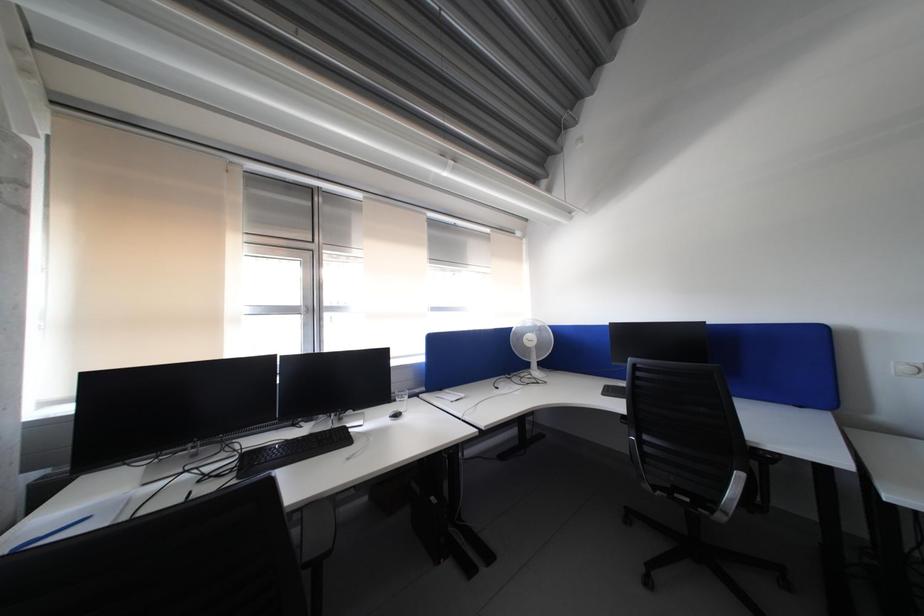
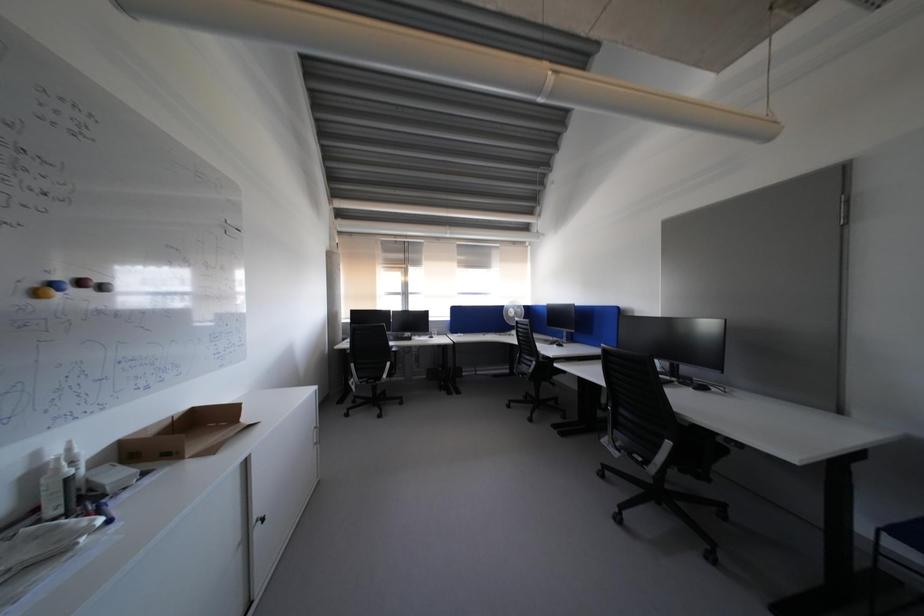
The images are taken continuously from a first-person perspective. In which direction are you moving?

The movement direction of the cameraman is right, backward.